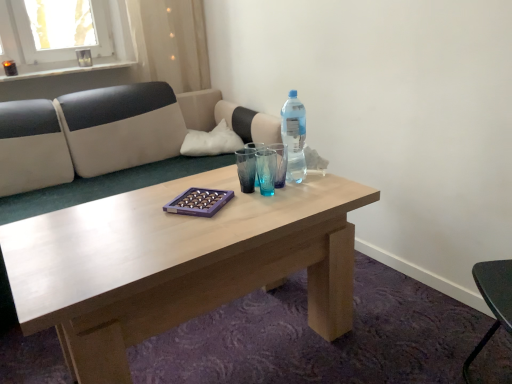
Question: Is transparent plastic bottle at center further to the viewer compared to translucent plastic bottle at center?

Choices:
 (A) yes
 (B) no

Answer: (B)

Question: Can you confirm if transparent plastic bottle at center is thinner than translucent plastic bottle at center?

Choices:
 (A) yes
 (B) no

Answer: (B)

Question: From the image's perspective, is transparent plastic bottle at center below translucent plastic bottle at center?

Choices:
 (A) yes
 (B) no

Answer: (A)

Question: Is transparent plastic bottle at center in front of translucent plastic bottle at center?

Choices:
 (A) yes
 (B) no

Answer: (A)

Question: Does transparent plastic bottle at center appear on the left side of translucent plastic bottle at center?

Choices:
 (A) yes
 (B) no

Answer: (A)

Question: Considering the relative sizes of transparent plastic bottle at center and translucent plastic bottle at center in the image provided, is transparent plastic bottle at center bigger than translucent plastic bottle at center?

Choices:
 (A) no
 (B) yes

Answer: (A)

Question: Is translucent plastic bottle at center far from white fabric pillow at upper center?

Choices:
 (A) no
 (B) yes

Answer: (A)

Question: Can you confirm if translucent plastic bottle at center is wider than white fabric pillow at upper center?

Choices:
 (A) no
 (B) yes

Answer: (A)

Question: Is translucent plastic bottle at center closer to the viewer compared to white fabric pillow at upper center?

Choices:
 (A) yes
 (B) no

Answer: (A)

Question: Can you confirm if translucent plastic bottle at center is smaller than white fabric pillow at upper center?

Choices:
 (A) yes
 (B) no

Answer: (A)

Question: Is translucent plastic bottle at center surrounding white fabric pillow at upper center?

Choices:
 (A) no
 (B) yes

Answer: (A)

Question: From the image's perspective, is translucent plastic bottle at center under white fabric pillow at upper center?

Choices:
 (A) yes
 (B) no

Answer: (A)

Question: Does white fabric pillow at upper center have a greater height compared to transparent plastic bottle at center?

Choices:
 (A) no
 (B) yes

Answer: (A)